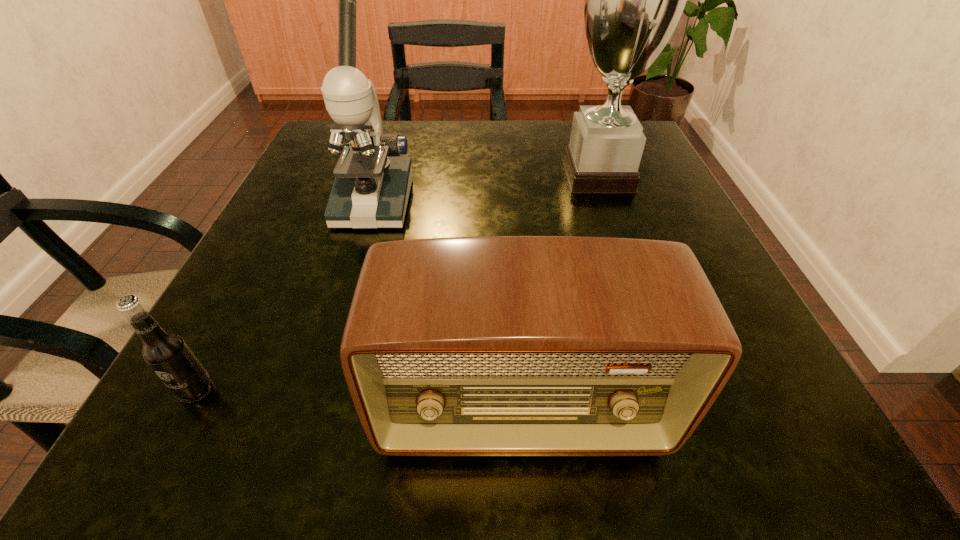
Where is `the tallest object`? This screenshot has width=960, height=540. the tallest object is located at coordinates (633, 0).

This screenshot has height=540, width=960. I want to click on microscope, so click(x=371, y=190).

Find the location of `the second object from left to right`. the second object from left to right is located at coordinates (371, 190).

The width and height of the screenshot is (960, 540). I want to click on the second shortest object, so click(x=493, y=345).

Locate an element on the screen. The height and width of the screenshot is (540, 960). root beer is located at coordinates (168, 355).

Where is `the leftmost object`? The height and width of the screenshot is (540, 960). the leftmost object is located at coordinates (168, 355).

You are a GUI agent. You are given a task and a screenshot of the screen. Output one action in this format:
    pyautogui.click(x=<x>, y=<y>)
    Task: Click on the free location located 0.340m at the front view of the tallest object
    The image size is (960, 540).
    Given the screenshot: What is the action you would take?
    pyautogui.click(x=389, y=176)

The height and width of the screenshot is (540, 960). Identify the location of free point located 0.050m at the front view of the tallest object. (533, 176).

This screenshot has width=960, height=540. In order to click on free region located at the front view of the tallest object in this screenshot , I will do `click(379, 176)`.

Locate an element on the screen. vacant space situated on the front of the second object from left to right is located at coordinates [x=305, y=427].